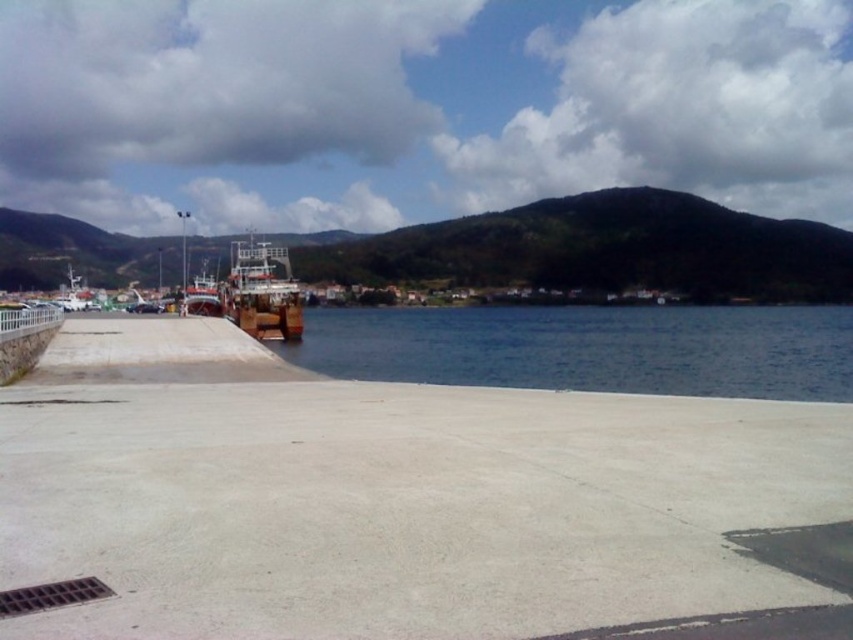
Can you confirm if blue water at center is thinner than wooden boat at center?

In fact, blue water at center might be wider than wooden boat at center.

Consider the image. Can you confirm if blue water at center is positioned to the right of wooden boat at center?

Answer: Indeed, blue water at center is positioned on the right side of wooden boat at center.

Who is more forward, (834, 396) or (204, 278)?

Point (834, 396)

Where is `blue water at center`? The width and height of the screenshot is (853, 640). blue water at center is located at coordinates (590, 348).

Is concrete at center positioned at the back of wooden boat at center?

That is False.

What do you see at coordinates (405, 500) in the screenshot?
I see `concrete at center` at bounding box center [405, 500].

Locate an element on the screen. concrete at center is located at coordinates (405, 500).

What do you see at coordinates (202, 294) in the screenshot?
I see `wooden boat at center` at bounding box center [202, 294].

Is point (189, 310) behind point (80, 308)?

That is False.

Is point (212, 273) closer to viewer compared to point (68, 266)?

That is True.

Identify the location of wooden boat at center. This screenshot has width=853, height=640. (202, 294).